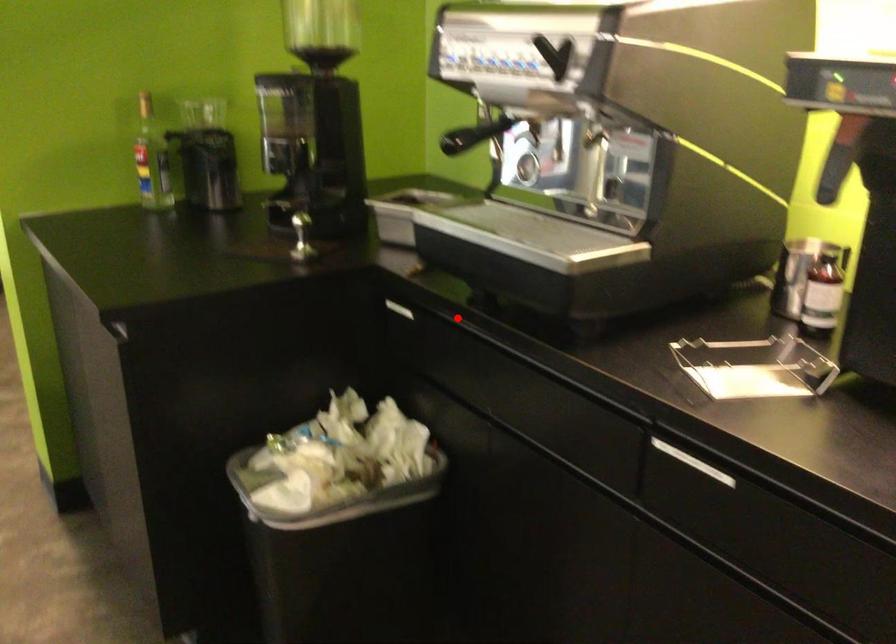
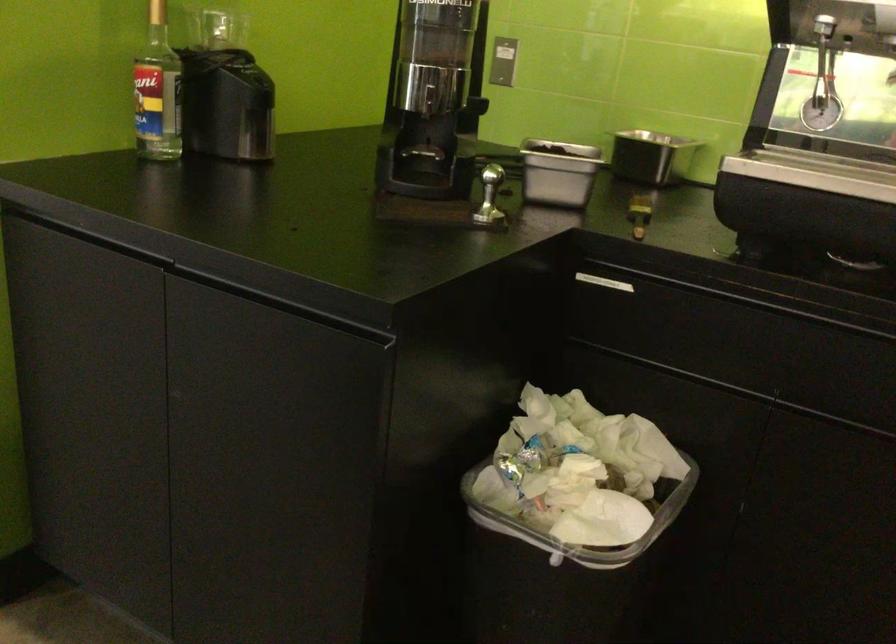
Question: I am providing you with two images of the same scene from different viewpoints. A red point is shown in image1. For the corresponding object point in image2, is it positioned nearer or farther from the camera?

Choices:
 (A) Nearer
 (B) Farther

Answer: (A)